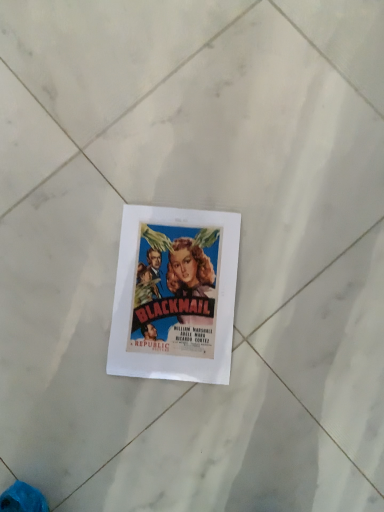
Describe the element at coordinates (175, 294) in the screenshot. I see `matte paper poster at center` at that location.

Image resolution: width=384 pixels, height=512 pixels. I want to click on matte paper poster at center, so pyautogui.click(x=175, y=294).

This screenshot has height=512, width=384. What are the coordinates of `matte paper poster at center` in the screenshot? It's located at (175, 294).